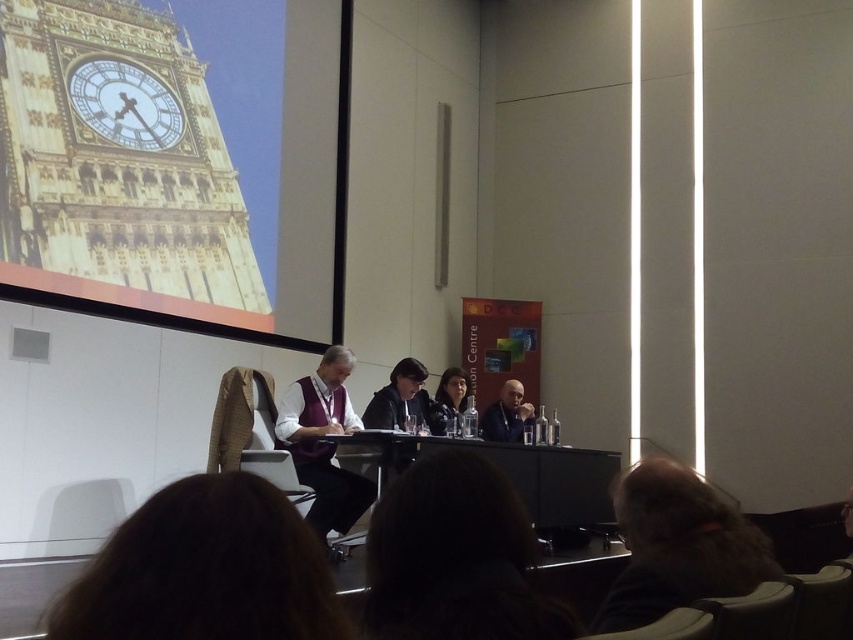
Does black glossy table at center have a smaller size compared to gold metallic clock at upper left?

Actually, black glossy table at center might be larger than gold metallic clock at upper left.

Is the position of black glossy table at center more distant than that of gold metallic clock at upper left?

No, it is in front of gold metallic clock at upper left.

Does point (554, 484) come closer to viewer compared to point (82, 76)?

No.

Where is `black glossy table at center`? black glossy table at center is located at coordinates (523, 472).

Is black glossy table at center above smooth black jacket at center?

No.

Is point (590, 477) closer to camera compared to point (508, 401)?

Yes, it is in front of point (508, 401).

Between point (544, 506) and point (532, 406), which one is positioned in front?

Positioned in front is point (544, 506).

You are a GUI agent. You are given a task and a screenshot of the screen. Output one action in this format:
    pyautogui.click(x=<x>, y=<y>)
    Task: Click on the black glossy table at center
    
    Given the screenshot: What is the action you would take?
    pyautogui.click(x=523, y=472)

Does smooth black jacket at center appear over matte black hair at center?

No, smooth black jacket at center is not above matte black hair at center.

Image resolution: width=853 pixels, height=640 pixels. Describe the element at coordinates (508, 413) in the screenshot. I see `smooth black jacket at center` at that location.

The height and width of the screenshot is (640, 853). What do you see at coordinates (508, 413) in the screenshot?
I see `smooth black jacket at center` at bounding box center [508, 413].

Image resolution: width=853 pixels, height=640 pixels. I want to click on smooth black jacket at center, so click(508, 413).